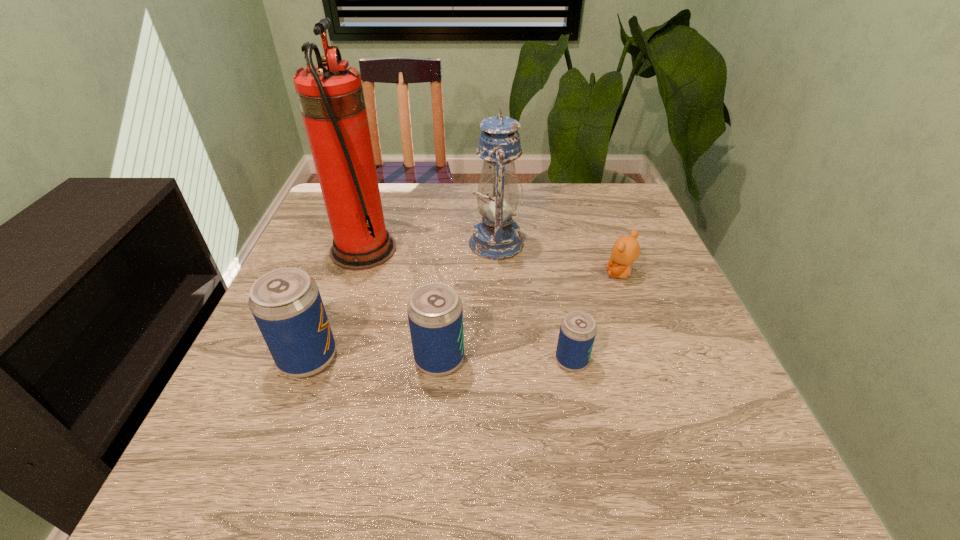
Where is `free spot located on the right of the second tallest beer can`? free spot located on the right of the second tallest beer can is located at coordinates (561, 360).

At what (x,y) coordinates should I click in order to perform the action: click on vacant region located 0.140m on the right of the rightmost beer can. Please return your answer as a coordinate pair (x, y). Looking at the image, I should click on (660, 361).

In order to click on vacant point located on the front-facing side of the third object from right to left in this screenshot , I will do `click(358, 243)`.

The height and width of the screenshot is (540, 960). What are the coordinates of `free region located 0.120m on the front-facing side of the third object from right to left` in the screenshot? It's located at (423, 243).

This screenshot has height=540, width=960. I want to click on vacant space located on the front-facing side of the third object from right to left, so 358,243.

Where is `vacant area situated on the face of the rightmost object`? Image resolution: width=960 pixels, height=540 pixels. vacant area situated on the face of the rightmost object is located at coordinates (551, 274).

Identify the location of free space located on the face of the rightmost object. This screenshot has width=960, height=540. (568, 274).

Identify the location of blank space located on the face of the rightmost object. (572, 274).

Image resolution: width=960 pixels, height=540 pixels. I want to click on vacant space located 0.150m at the discharge end of the tallest object, so click(455, 250).

You are a GUI agent. You are given a task and a screenshot of the screen. Output one action in this format:
    pyautogui.click(x=<x>, y=<y>)
    Task: Click on the object that is positioned at the far edge
    This screenshot has height=540, width=960.
    Given the screenshot: What is the action you would take?
    pyautogui.click(x=496, y=236)